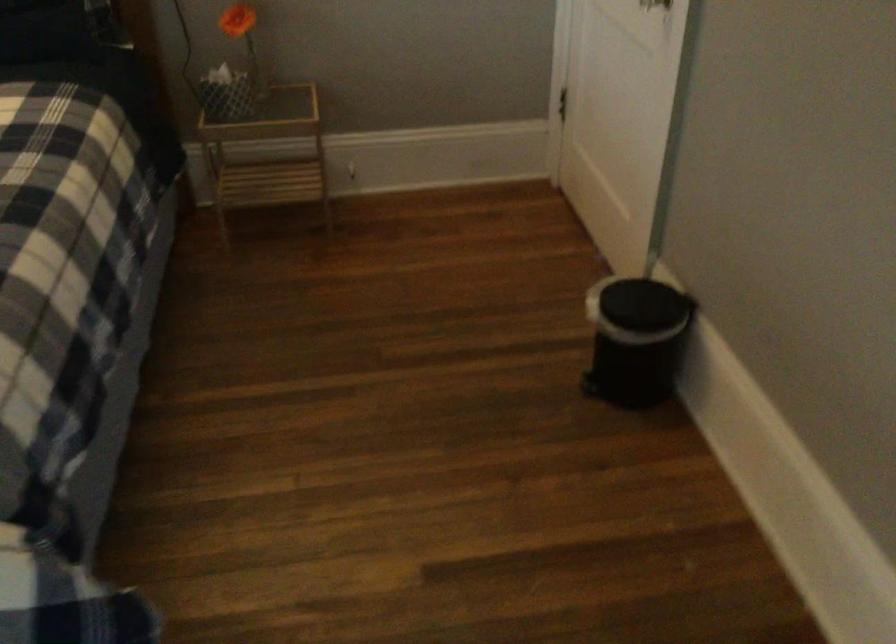
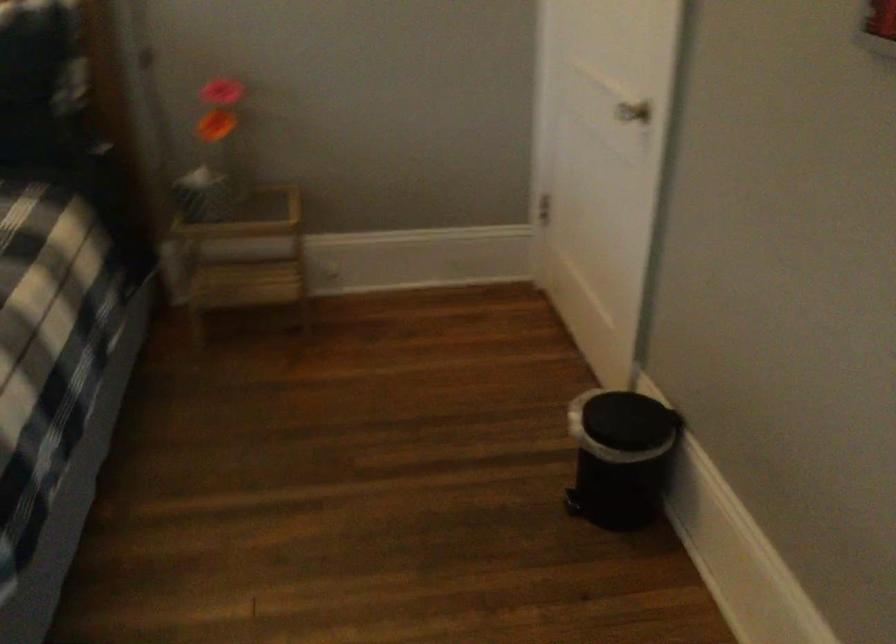
Find the pixel in the second image that matches (590,384) in the first image.

(573, 504)